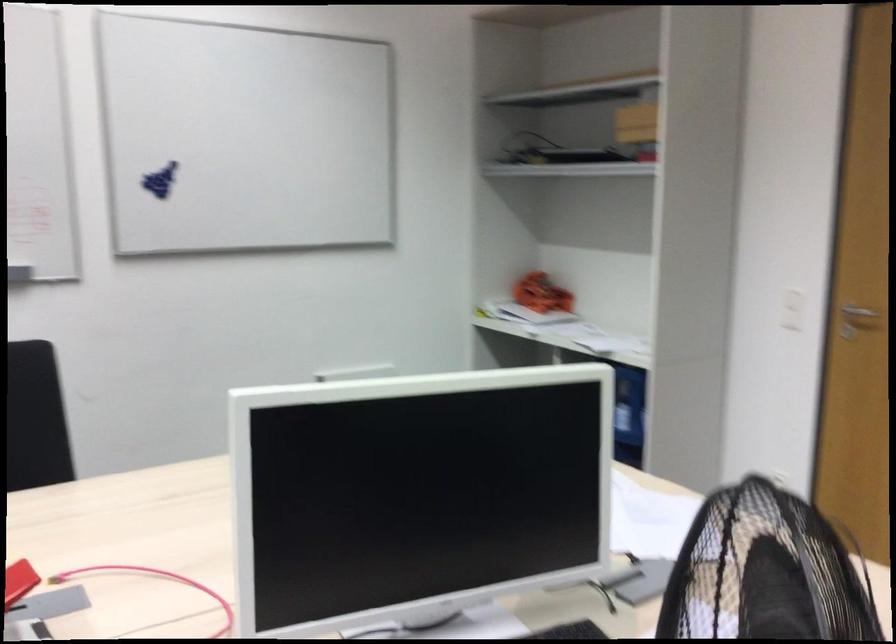
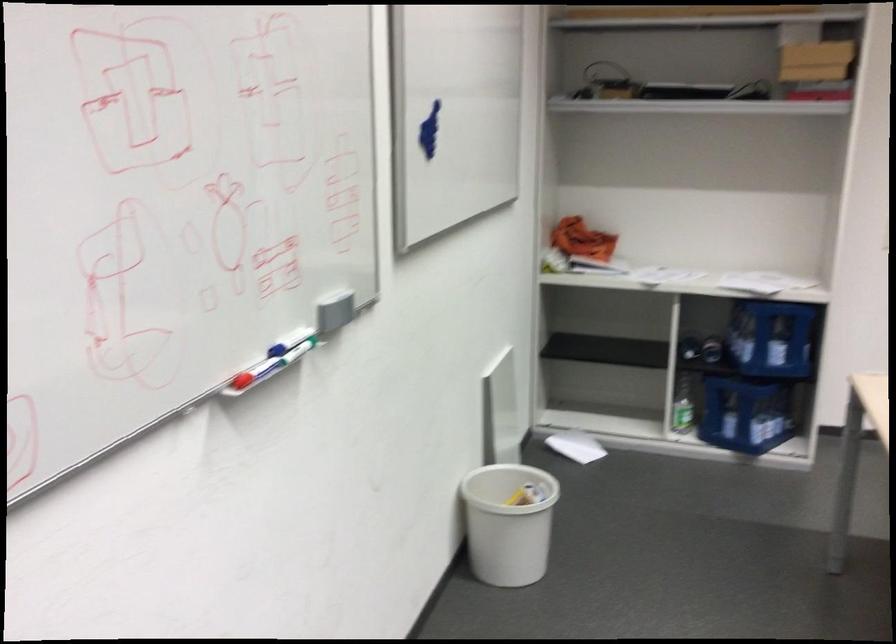
The point at (609, 317) is marked in the first image. Where is the corresponding point in the second image?

(660, 275)